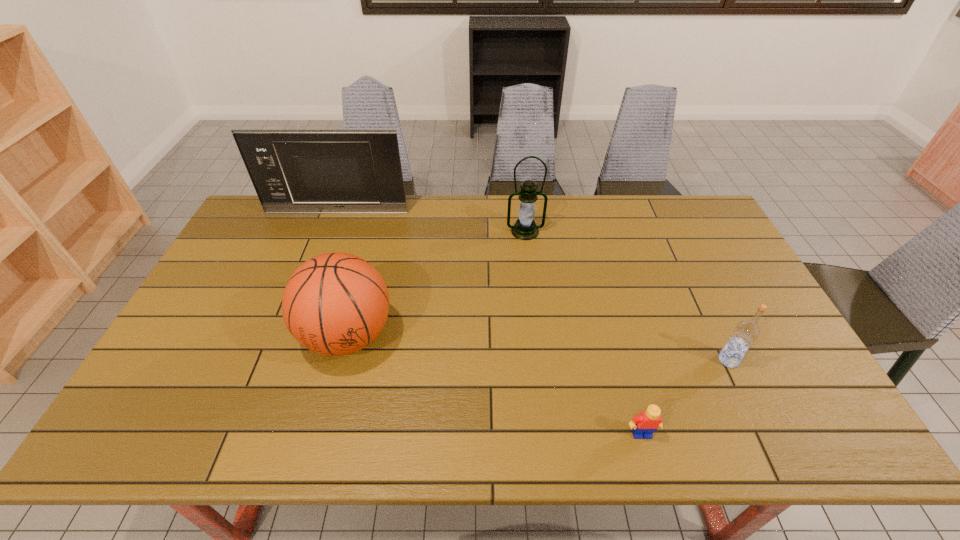
This screenshot has width=960, height=540. Find the location of `vacant point located between the farthest object and the third object from right to left`. vacant point located between the farthest object and the third object from right to left is located at coordinates (431, 222).

Image resolution: width=960 pixels, height=540 pixels. Find the location of `free spot between the fourth object from left to right and the basketball`. free spot between the fourth object from left to right and the basketball is located at coordinates (494, 385).

Select which object appears as the fourth closest to the rightmost object. Please provide its 2D coordinates. Your answer should be formatted as a tuple, i.e. [(x, y)], where the tuple contains the x and y coordinates of a point satisfying the conditions above.

[(293, 171)]

Find the location of `the closest object to the second object from right to left`. the closest object to the second object from right to left is located at coordinates (746, 332).

Find the location of a particular element. This screenshot has width=960, height=540. vacant region that satisfies the following two spatial constraints: 1. on the front panel of the basketball; 2. on the right side of the farthest object is located at coordinates (290, 336).

Image resolution: width=960 pixels, height=540 pixels. What are the coordinates of `vacant point that satisfies the following two spatial constraints: 1. on the front panel of the microwave oven; 2. on the right side of the fourth tallest object` in the screenshot? It's located at (280, 360).

The image size is (960, 540). Find the location of `blank space that satisfies the following two spatial constraints: 1. on the front panel of the basketball; 2. on the left side of the microwave oven`. blank space that satisfies the following two spatial constraints: 1. on the front panel of the basketball; 2. on the left side of the microwave oven is located at coordinates (290, 336).